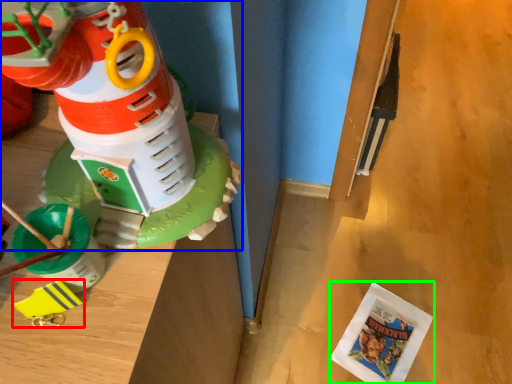
Question: Estimate the real-world distances between objects in this image. Which object is closer to toy (highlighted by a red box), toy (highlighted by a blue box) or comic book (highlighted by a green box)?

Choices:
 (A) toy
 (B) comic book

Answer: (A)